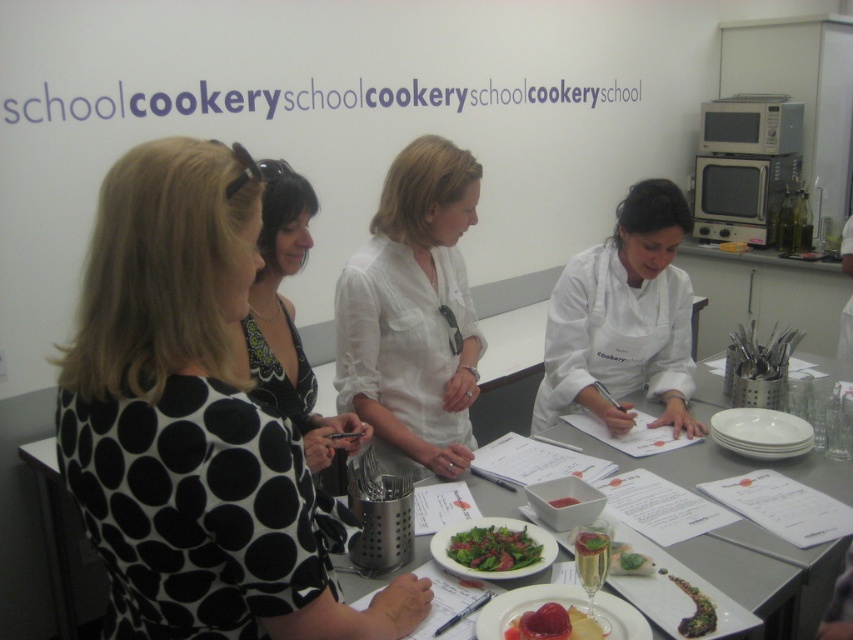
Question: Where is black dotted dress at left located in relation to white cotton shirt at center in the image?

Choices:
 (A) right
 (B) left

Answer: (B)

Question: Is black dotted dress at left positioned in front of green leafy vegetable at center?

Choices:
 (A) no
 (B) yes

Answer: (B)

Question: Does white cotton shirt at center appear on the right side of white paper at center?

Choices:
 (A) yes
 (B) no

Answer: (B)

Question: Which point is farther to the camera?

Choices:
 (A) white paper at center
 (B) green leafy vegetable at center
 (C) smooth pink jelly at center

Answer: (A)

Question: Which object is closer to the camera taking this photo?

Choices:
 (A) white smooth apron at lower right
 (B) white glossy platter at lower right

Answer: (B)

Question: Considering the real-world distances, which object is closest to the smooth pink jelly at center?

Choices:
 (A) white paper at center
 (B) smooth white bowl at center

Answer: (B)